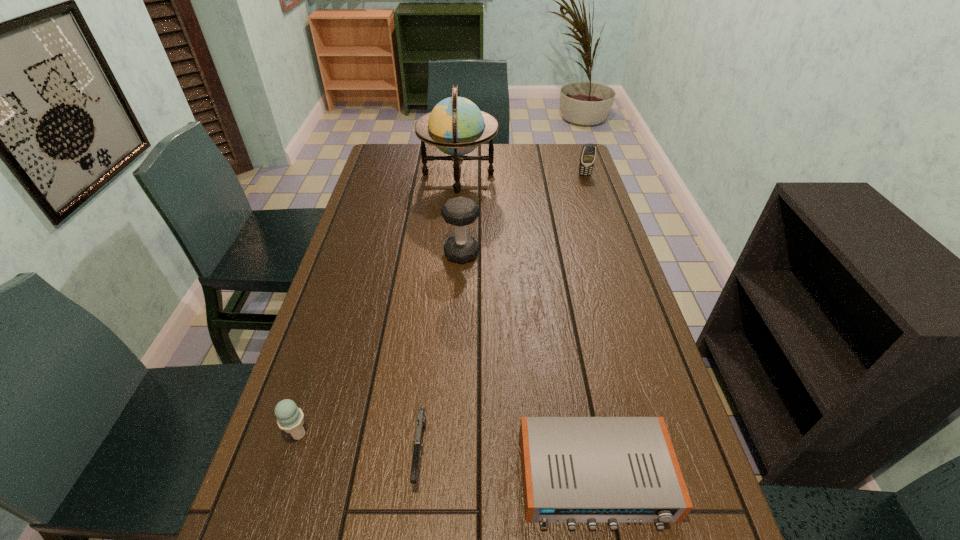
The image size is (960, 540). What are the coordinates of `vacant space located 0.250m on the back of the leftmost object` in the screenshot? It's located at (331, 333).

This screenshot has width=960, height=540. In order to click on object that is at the far edge in this screenshot , I will do `click(456, 126)`.

The image size is (960, 540). I want to click on object at the left edge, so click(290, 418).

I want to click on cellular telephone present at the right edge, so click(x=587, y=158).

Identify the location of radio receiver that is at the right edge. (574, 469).

The height and width of the screenshot is (540, 960). I want to click on vacant space at the far edge of the desktop, so click(512, 149).

The width and height of the screenshot is (960, 540). In the image, there is a desktop. Identify the location of free region at the left edge. (364, 225).

This screenshot has width=960, height=540. Find the location of `vacant point at the right edge`. vacant point at the right edge is located at coordinates (578, 227).

Locate an element on the screen. The height and width of the screenshot is (540, 960). vacant space at the far right corner is located at coordinates (563, 164).

Locate an element on the screen. unoccupied area between the second object from right to left and the second tallest object is located at coordinates (528, 367).